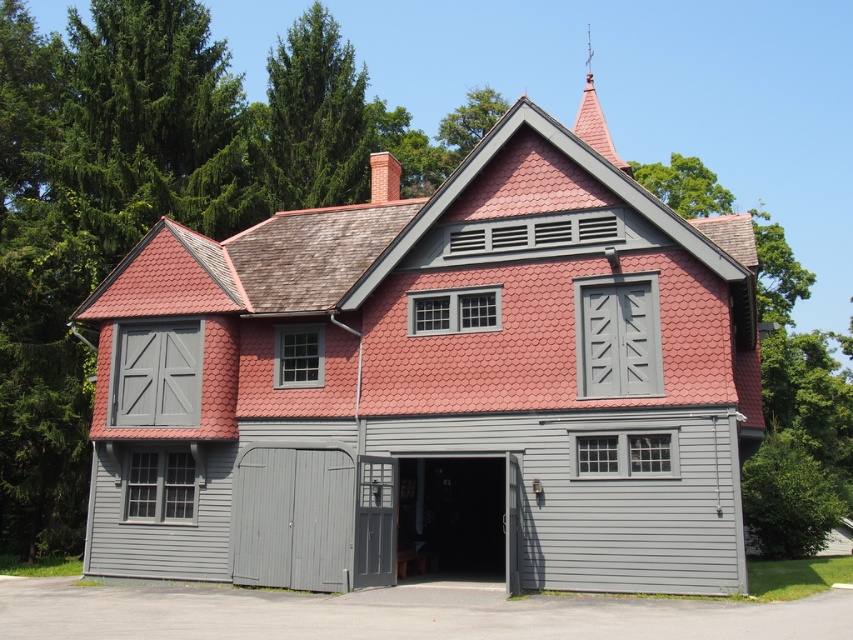
You are standing in front of the two story building and need to locate the matte gray shed at center. According to the coordinates provided, where exactly is the matte gray shed positioned relative to the building?

The matte gray shed at center is located at point coordinates (445,372) relative to the building.